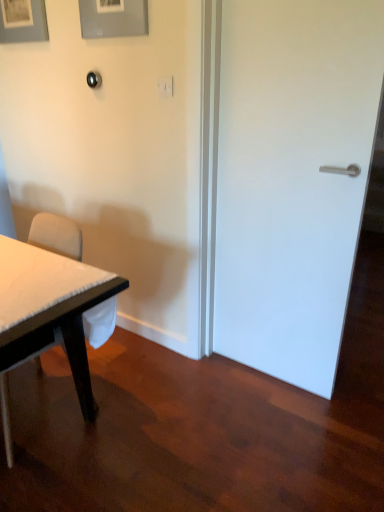
Question: Is white matte door at right smaller than white fabric chair at left?

Choices:
 (A) no
 (B) yes

Answer: (B)

Question: Does white matte door at right have a lesser width compared to white fabric chair at left?

Choices:
 (A) yes
 (B) no

Answer: (A)

Question: Is the position of white matte door at right less distant than that of white fabric chair at left?

Choices:
 (A) no
 (B) yes

Answer: (A)

Question: Is white matte door at right shorter than white fabric chair at left?

Choices:
 (A) no
 (B) yes

Answer: (A)

Question: From the image's perspective, is white matte door at right beneath white fabric chair at left?

Choices:
 (A) yes
 (B) no

Answer: (B)

Question: Is matte gray picture frame at upper left, which is the 2th picture frame in right-to-left order, to the left or to the right of matte gray picture frame at upper center, the 2th picture frame from the left, in the image?

Choices:
 (A) right
 (B) left

Answer: (B)

Question: Relative to matte gray picture frame at upper center, which is the 2th picture frame in back-to-front order, is matte gray picture frame at upper left, acting as the 2th picture frame starting from the front, in front or behind?

Choices:
 (A) behind
 (B) front

Answer: (A)

Question: Is matte gray picture frame at upper left, which is the first picture frame from left to right, situated inside matte gray picture frame at upper center, which is the 2th picture frame in back-to-front order, or outside?

Choices:
 (A) outside
 (B) inside

Answer: (A)

Question: Considering the positions of matte gray picture frame at upper left, acting as the 2th picture frame starting from the front, and matte gray picture frame at upper center, which is the 2th picture frame in back-to-front order, in the image, is matte gray picture frame at upper left, acting as the 2th picture frame starting from the front, wider or thinner than matte gray picture frame at upper center, which is the 2th picture frame in back-to-front order,?

Choices:
 (A) wide
 (B) thin

Answer: (A)

Question: In the image, is white matte door at right positioned in front of or behind matte gray picture frame at upper left, which is the first picture frame from left to right?

Choices:
 (A) behind
 (B) front

Answer: (B)

Question: Based on their sizes in the image, would you say white matte door at right is bigger or smaller than matte gray picture frame at upper left, acting as the 2th picture frame starting from the front?

Choices:
 (A) small
 (B) big

Answer: (B)

Question: Is point click(218, 263) closer or farther from the camera than point click(0, 34)?

Choices:
 (A) farther
 (B) closer

Answer: (B)

Question: From the image's perspective, is white matte door at right positioned above or below matte gray picture frame at upper left, which is the first picture frame from left to right?

Choices:
 (A) below
 (B) above

Answer: (A)

Question: Considering the positions of white fabric chair at left and matte gray picture frame at upper left, which is the first picture frame from left to right, in the image, is white fabric chair at left wider or thinner than matte gray picture frame at upper left, which is the first picture frame from left to right,?

Choices:
 (A) wide
 (B) thin

Answer: (A)

Question: From a real-world perspective, relative to matte gray picture frame at upper left, acting as the 2th picture frame starting from the front, is white fabric chair at left vertically above or below?

Choices:
 (A) below
 (B) above

Answer: (A)